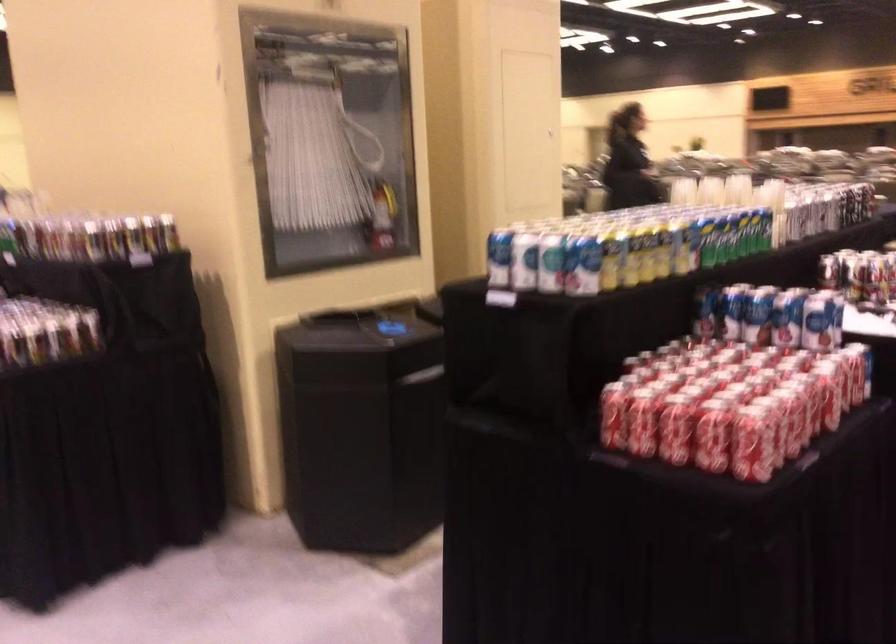
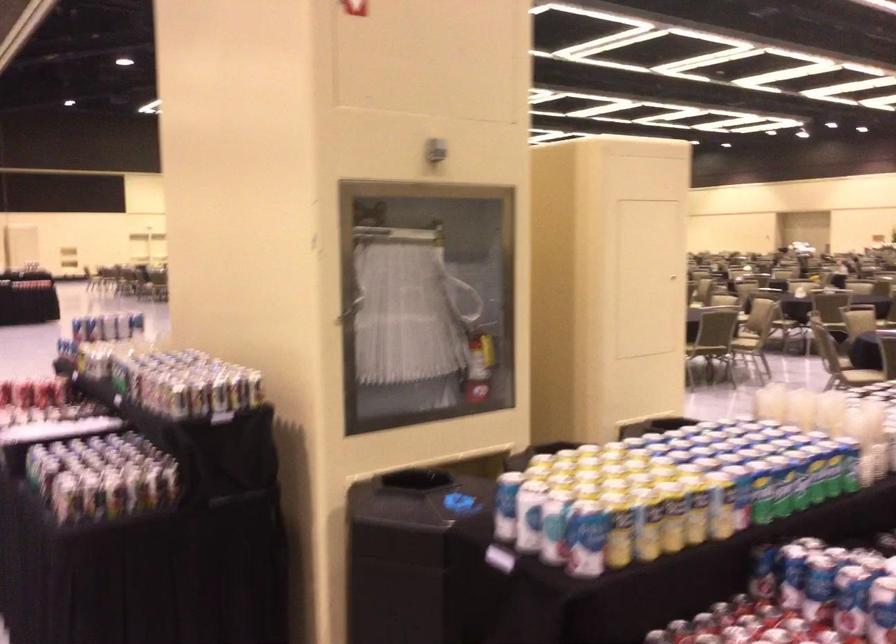
Where in the second image is the point corresponding to [259,152] from the first image?

(349, 310)